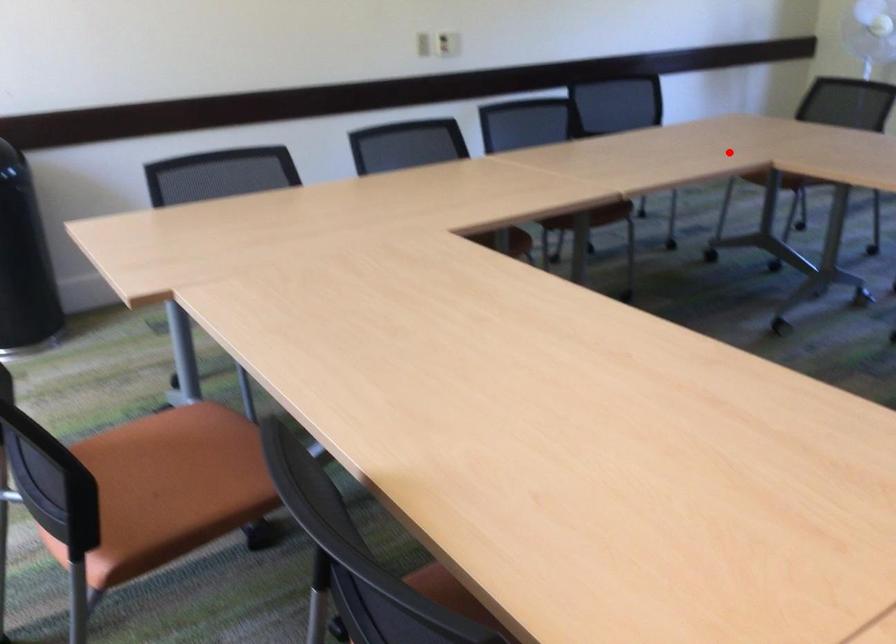
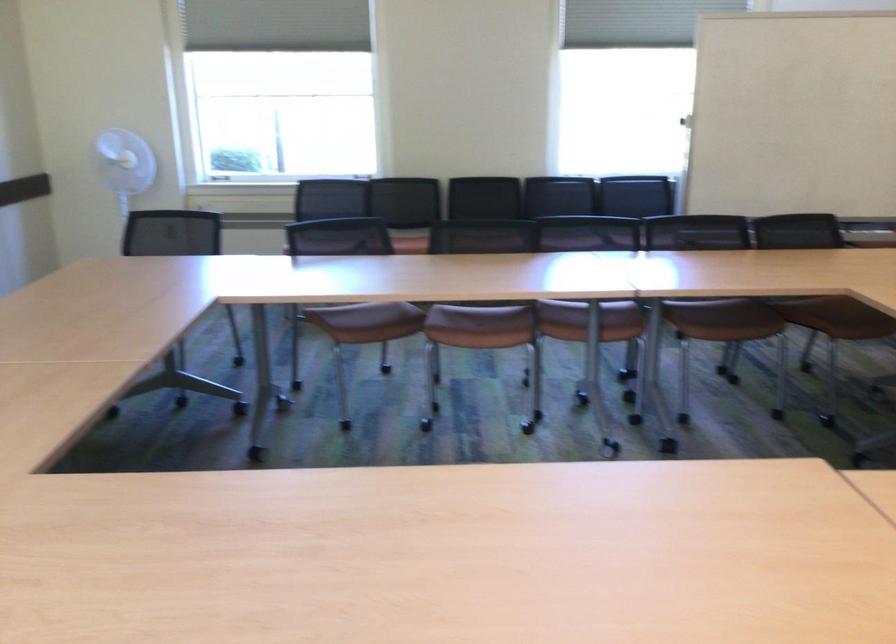
In the second image, find the point that corresponds to the highlighted location in the first image.

(177, 292)